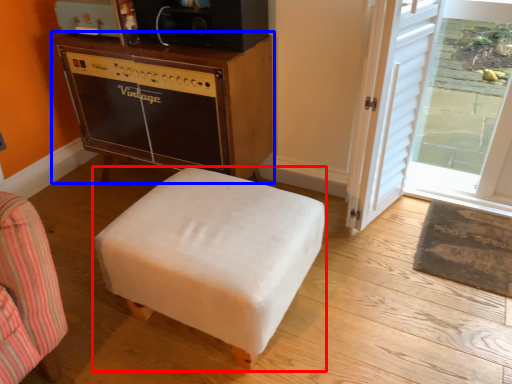
Question: Which object appears farthest to the camera in this image, furniture (highlighted by a red box) or table (highlighted by a blue box)?

Choices:
 (A) furniture
 (B) table

Answer: (B)